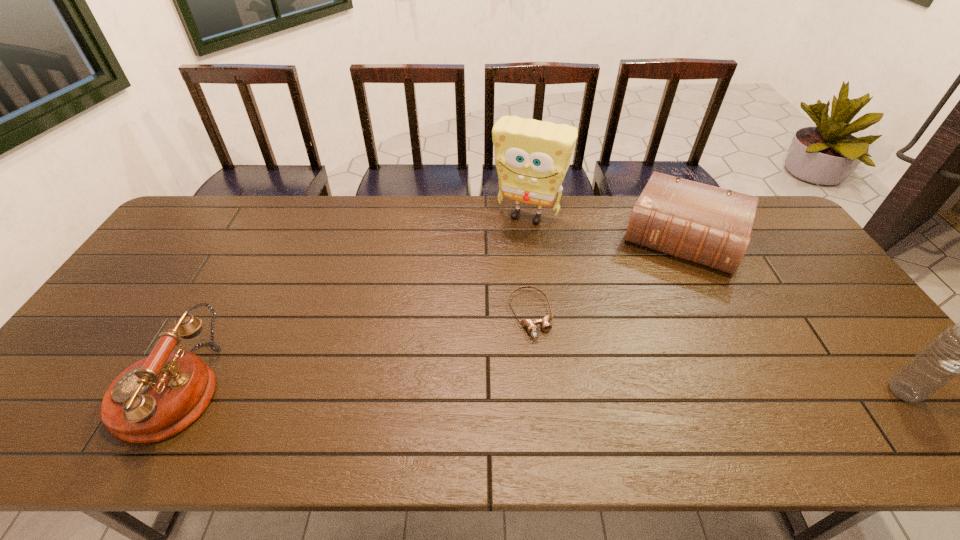
Find the location of a particular element. This screenshot has height=540, width=960. vacant point at the left edge is located at coordinates (129, 362).

In order to click on vacant space at the right edge of the desktop in this screenshot , I will do `click(806, 254)`.

The image size is (960, 540). I want to click on free space at the near right corner of the desktop, so click(x=878, y=379).

The width and height of the screenshot is (960, 540). In order to click on free space between the tallest object and the Bible in this screenshot , I will do `click(605, 227)`.

This screenshot has width=960, height=540. I want to click on free space that is in between the shortest object and the telephone, so click(351, 352).

At what (x,y) coordinates should I click in order to perform the action: click on empty location between the water bottle and the fourth object from left to right. Please return your answer as a coordinate pair (x, y). Image resolution: width=960 pixels, height=540 pixels. Looking at the image, I should click on (793, 315).

You are a GUI agent. You are given a task and a screenshot of the screen. Output one action in this format:
    pyautogui.click(x=<x>, y=<y>)
    Task: Click on the empty space between the shortest object and the second object from right to left
    
    Given the screenshot: What is the action you would take?
    click(x=607, y=276)

The height and width of the screenshot is (540, 960). In order to click on vacant point located between the sponge and the second object from right to left in this screenshot , I will do (605, 227).

You are a GUI agent. You are given a task and a screenshot of the screen. Output one action in this format:
    pyautogui.click(x=<x>, y=<y>)
    Task: Click on the vacant area that lies between the shortest object and the third tallest object
    
    Given the screenshot: What is the action you would take?
    pyautogui.click(x=351, y=352)

Find the location of a particular element. The image size is (960, 540). vacant area that lies between the rightmost object and the goggles is located at coordinates (717, 353).